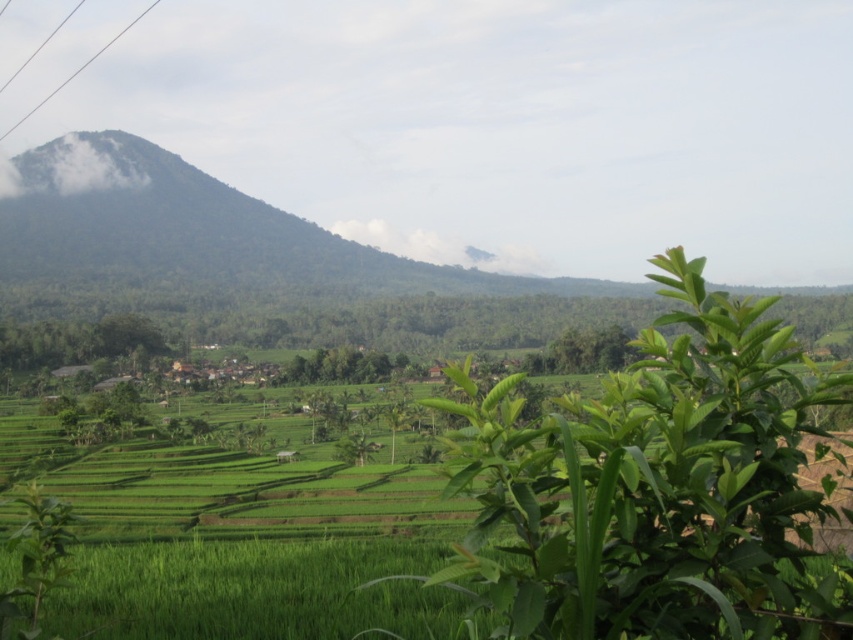
Can you confirm if green leafy plant at center is bigger than metallic wire at upper left?

Incorrect, green leafy plant at center is not larger than metallic wire at upper left.

Is green leafy plant at center behind metallic wire at upper left?

No, green leafy plant at center is in front of metallic wire at upper left.

Is point (682, 456) in front of point (86, 60)?

Yes, point (682, 456) is in front of point (86, 60).

The height and width of the screenshot is (640, 853). I want to click on green leafy plant at center, so click(660, 490).